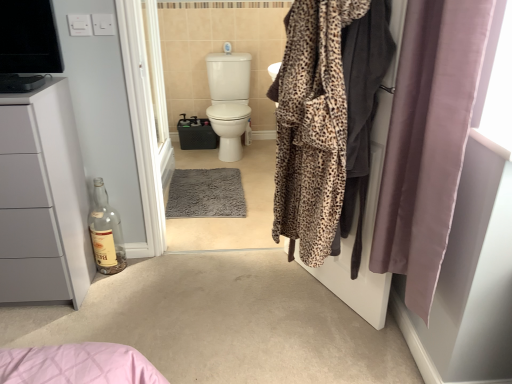
Question: Considering their positions, is white glossy toilet at center located in front of or behind clear glass bottle at lower left?

Choices:
 (A) front
 (B) behind

Answer: (B)

Question: From a real-world perspective, is white glossy toilet at center above or below clear glass bottle at lower left?

Choices:
 (A) below
 (B) above

Answer: (B)

Question: Which is nearer to the white glossy screen door at center, acting as the second screen door starting from the front?

Choices:
 (A) silky mauve curtain at right
 (B) matte white cabinet at left
 (C) clear glass bottle at lower left
 (D) leopard print robe at right
 (E) white glossy toilet at center

Answer: (C)

Question: Which is nearer to the clear glass bottle at lower left?

Choices:
 (A) leopard print robe at center, the second screen door when ordered from back to front
 (B) matte white cabinet at left
 (C) silky mauve curtain at right
 (D) white glossy screen door at center, acting as the second screen door starting from the front
 (E) leopard print robe at right

Answer: (D)